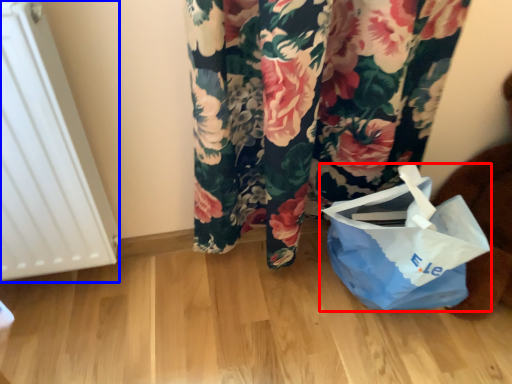
Question: Which of the following is the farthest to the observer, plastic bag (highlighted by a red box) or radiator (highlighted by a blue box)?

Choices:
 (A) plastic bag
 (B) radiator

Answer: (A)